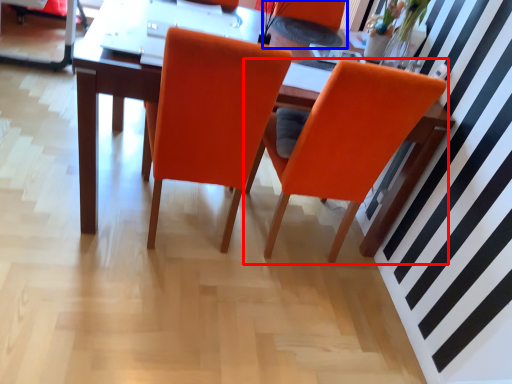
Question: Which of the following is the closest to the observer, chair (highlighted by a red box) or armchair (highlighted by a blue box)?

Choices:
 (A) chair
 (B) armchair

Answer: (A)